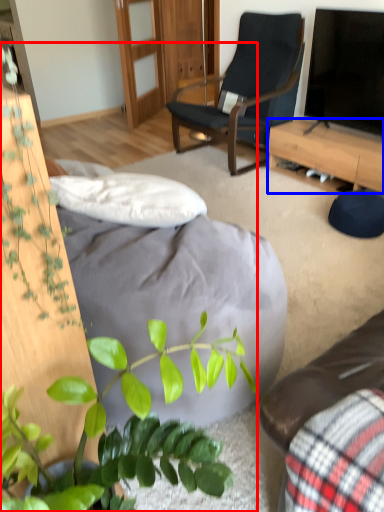
Question: Which object appears farthest to the camera in this image, houseplant (highlighted by a red box) or desk (highlighted by a blue box)?

Choices:
 (A) houseplant
 (B) desk

Answer: (B)